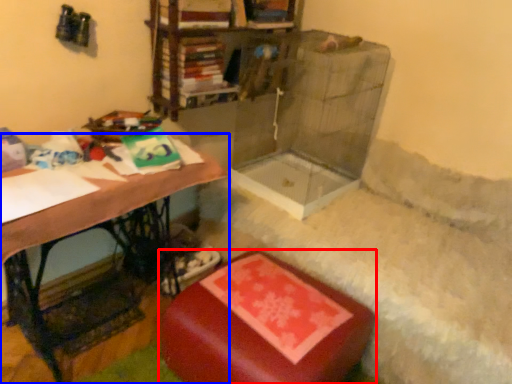
Question: Which point is closer to the camera, furniture (highlighted by a red box) or table (highlighted by a blue box)?

Choices:
 (A) furniture
 (B) table

Answer: (B)